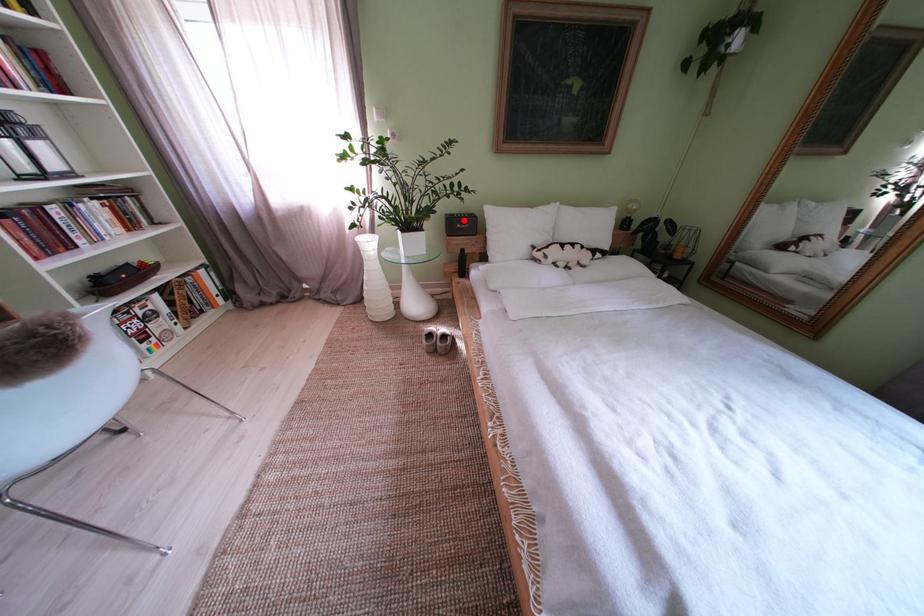
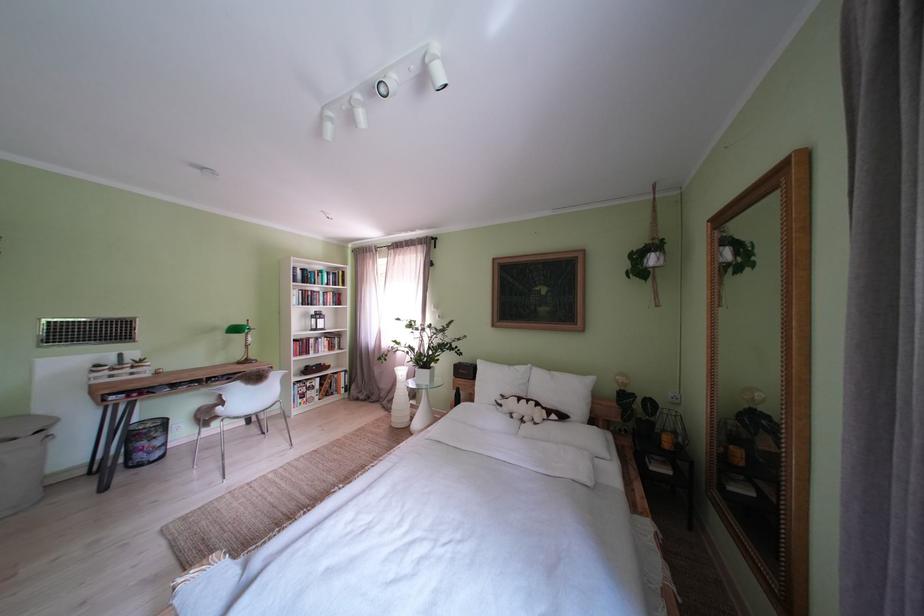
Question: I am providing you with two images of the same scene from different viewpoints. Image1 has a red point marked. In image2, the corresponding 3D location appears at what relative position? Reply with the corresponding letter.

Choices:
 (A) Closer
 (B) Farther

Answer: (B)